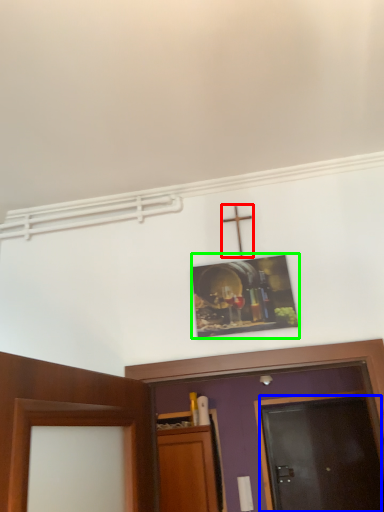
Question: Which object is positioned closest to crucifix (highlighted by a red box)? Select from door (highlighted by a blue box) and picture frame (highlighted by a green box).

Choices:
 (A) door
 (B) picture frame

Answer: (B)